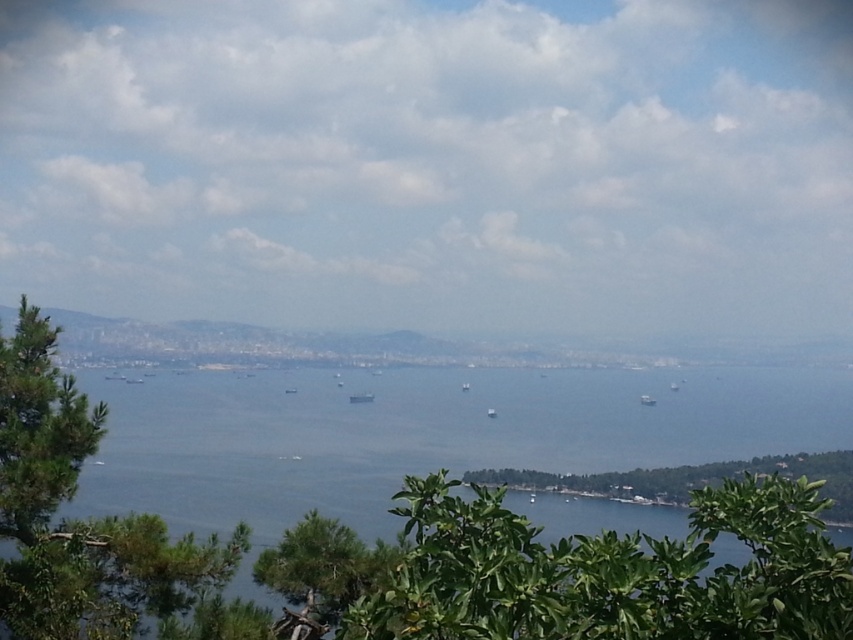
Question: Does blue water at center lie behind green leafy tree at left?

Choices:
 (A) yes
 (B) no

Answer: (B)

Question: Which point appears farthest from the camera in this image?

Choices:
 (A) (541, 440)
 (B) (204, 612)

Answer: (A)

Question: Is green leafy tree at left closer to the viewer compared to green leafy bush at lower right?

Choices:
 (A) no
 (B) yes

Answer: (A)

Question: Which of the following is the farthest from the observer?

Choices:
 (A) (662, 472)
 (B) (183, 444)

Answer: (A)

Question: Does blue water at center have a larger size compared to green leafy bush at lower right?

Choices:
 (A) no
 (B) yes

Answer: (B)

Question: Which point is closer to the camera taking this photo?

Choices:
 (A) (171, 588)
 (B) (805, 464)

Answer: (A)